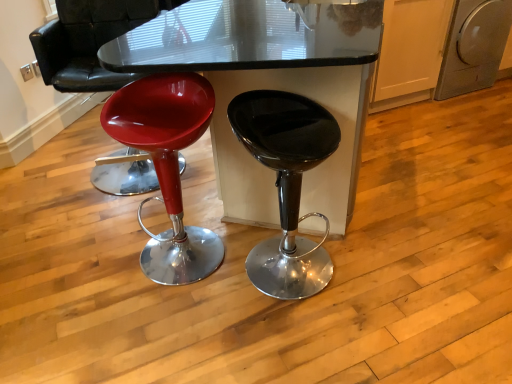
Find the location of a particular element. The height and width of the screenshot is (384, 512). empty space that is to the right of glossy glass table at center is located at coordinates (436, 170).